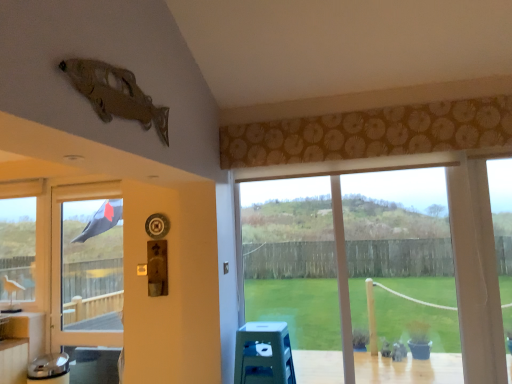
Question: Visually, is black fabric screen door at left positioned to the left or to the right of clear glass window at left, arranged as the second window when viewed from the front?

Choices:
 (A) left
 (B) right

Answer: (B)

Question: Considering the positions of black fabric screen door at left and clear glass window at left, the first window positioned from the left, in the image, is black fabric screen door at left taller or shorter than clear glass window at left, the first window positioned from the left,?

Choices:
 (A) tall
 (B) short

Answer: (A)

Question: Estimate the real-world distances between objects in this image. Which object is farther from the clear glass window at left, arranged as the second window when viewed from the front?

Choices:
 (A) blue plastic stool at lower center
 (B) transparent glass window at center, the 1th window when ordered from front to back
 (C) black fabric screen door at left

Answer: (B)

Question: Estimate the real-world distances between objects in this image. Which object is farther from the blue plastic stool at lower center?

Choices:
 (A) black fabric screen door at left
 (B) transparent glass window at center, the second window viewed from the back
 (C) clear glass window at left, which is the 2th window from right to left

Answer: (C)